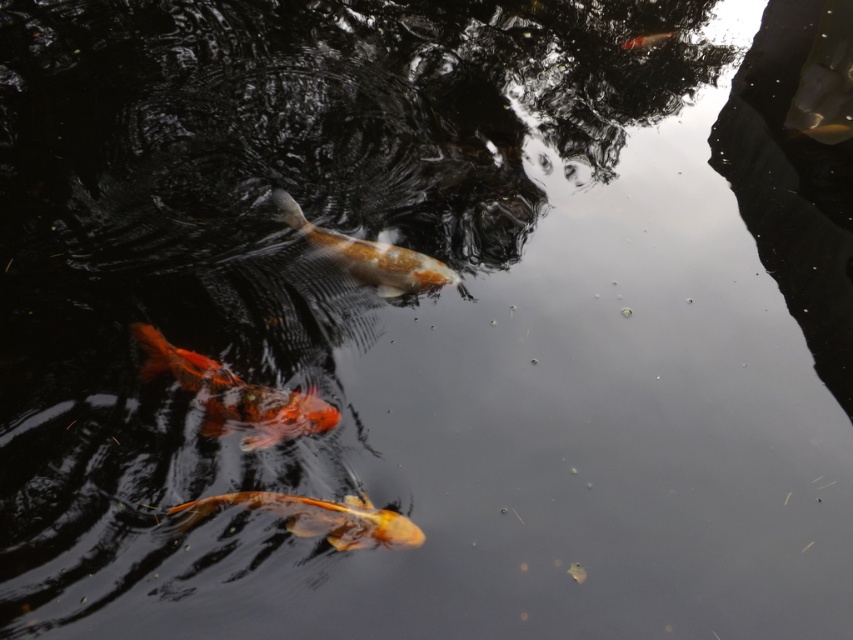
Does shiny orange fish at lower left have a smaller size compared to shiny orange fish at upper right?

No, shiny orange fish at lower left is not smaller than shiny orange fish at upper right.

Can you confirm if shiny orange fish at lower left is positioned below shiny orange fish at upper right?

Yes.

Does point (253, 392) come farther from viewer compared to point (647, 42)?

No, (253, 392) is in front of (647, 42).

You are a GUI agent. You are given a task and a screenshot of the screen. Output one action in this format:
    pyautogui.click(x=<x>, y=<y>)
    Task: Click on the shiny orange fish at lower left
    Image resolution: width=853 pixels, height=640 pixels.
    Given the screenshot: What is the action you would take?
    pyautogui.click(x=234, y=396)

Does shiny orange goldfish at lower center appear over shiny orange fish at center?

Incorrect, shiny orange goldfish at lower center is not positioned above shiny orange fish at center.

Which is above, shiny orange goldfish at lower center or shiny orange fish at center?

shiny orange fish at center is higher up.

Looking at this image, who is more forward, (x=233, y=502) or (x=345, y=244)?

Point (x=233, y=502)

This screenshot has height=640, width=853. Identify the location of shiny orange goldfish at lower center. (321, 518).

Is the position of shiny orange fish at lower left more distant than that of shiny orange goldfish at lower center?

Yes, shiny orange fish at lower left is behind shiny orange goldfish at lower center.

Can you confirm if shiny orange fish at lower left is positioned to the right of shiny orange goldfish at lower center?

Incorrect, shiny orange fish at lower left is not on the right side of shiny orange goldfish at lower center.

The image size is (853, 640). What are the coordinates of `shiny orange fish at lower left` in the screenshot? It's located at (234, 396).